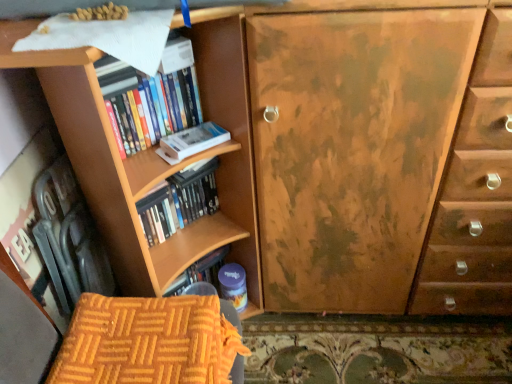
Question: Considering the positions of hardcover books at left, which is the first book in top-to-bottom order, and orange quilted fabric armchair at lower left in the image, is hardcover books at left, which is the first book in top-to-bottom order, bigger or smaller than orange quilted fabric armchair at lower left?

Choices:
 (A) small
 (B) big

Answer: (B)

Question: Is hardcover books at left, positioned as the second book in bottom-to-top order, wider or thinner than orange quilted fabric armchair at lower left?

Choices:
 (A) thin
 (B) wide

Answer: (A)

Question: Which object is positioned closest to the hardcover books at left, which is the first book in top-to-bottom order?

Choices:
 (A) orange quilted fabric armchair at lower left
 (B) wooden bookshelf at center, which is the first book from bottom to top
 (C) white matte paperback book at upper left

Answer: (C)

Question: Which of these objects is positioned closest to the wooden bookshelf at center, the 2th book in the top-to-bottom sequence?

Choices:
 (A) orange quilted fabric armchair at lower left
 (B) hardcover books at left, which is the first book in top-to-bottom order
 (C) white matte paperback book at upper left

Answer: (C)